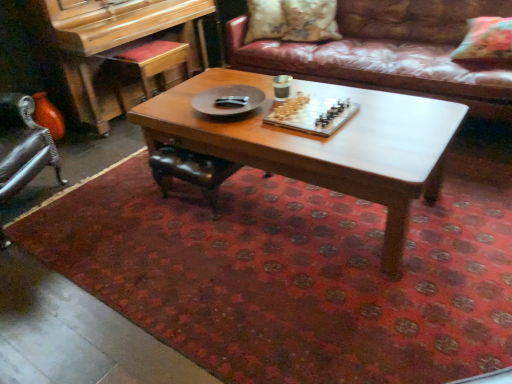
Question: Which is correct: wooden piano at left is inside floral fabric pillow at upper right, which ranks as the first pillow in front-to-back order, or outside of it?

Choices:
 (A) inside
 (B) outside

Answer: (B)

Question: Is wooden piano at left bigger or smaller than floral fabric pillow at upper right, acting as the 1th pillow starting from the right?

Choices:
 (A) small
 (B) big

Answer: (B)

Question: Estimate the real-world distances between objects in this image. Which object is closer to the fluffy beige pillow at upper center, which appears as the second pillow when viewed from the right?

Choices:
 (A) floral fabric pillow at upper right, which ranks as the first pillow in front-to-back order
 (B) floral fabric pillow at upper center, arranged as the third pillow when viewed from the right
 (C) wooden chessboard at center
 (D) wooden piano at left
 (E) translucent glass chessboard at center

Answer: (B)

Question: Considering the real-world distances, which object is farthest from the wooden piano at left?

Choices:
 (A) translucent glass chessboard at center
 (B) brown leather couch at upper center
 (C) fluffy beige pillow at upper center, which appears as the second pillow when viewed from the left
 (D) floral fabric pillow at upper right, arranged as the third pillow when viewed from the left
 (E) floral fabric pillow at upper center, which is counted as the first pillow, starting from the left

Answer: (D)